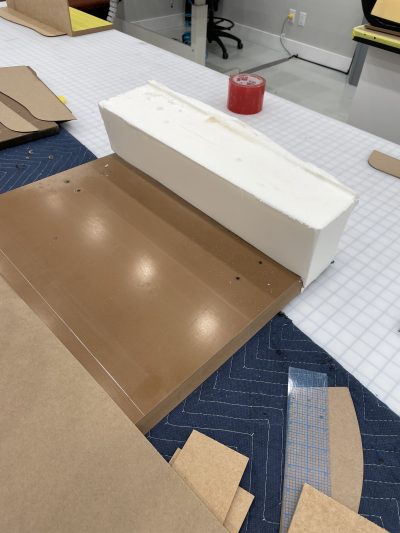
Where is `cloth`? This screenshot has width=400, height=533. cloth is located at coordinates (251, 381), (384, 453).